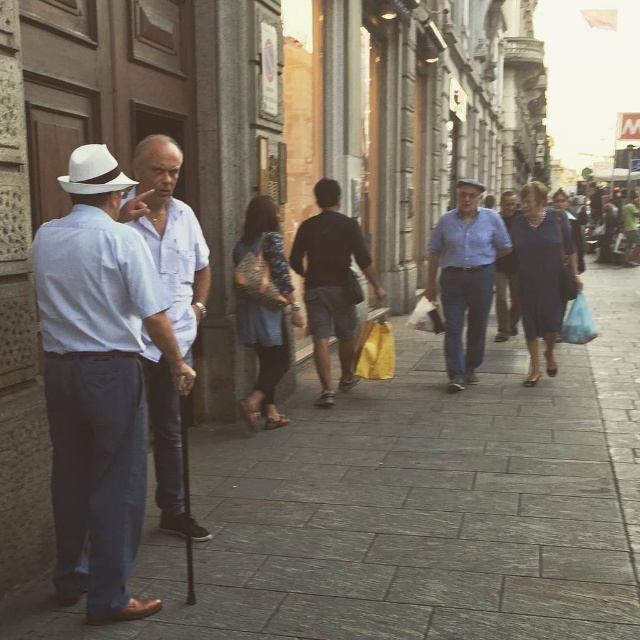
Question: Which object appears closest to the camera in this image?

Choices:
 (A) black felt fedora at center
 (B) gray stone pavement at left

Answer: (B)

Question: Can you confirm if matte white shirt at center is wider than white felt fedora at left?

Choices:
 (A) yes
 (B) no

Answer: (A)

Question: Is blue cotton shirt at center to the left of blue denim jeans at center from the viewer's perspective?

Choices:
 (A) yes
 (B) no

Answer: (A)

Question: Which point is farther to the camera?

Choices:
 (A) (x=516, y=308)
 (B) (x=300, y=272)

Answer: (A)

Question: Does white felt fedora at left have a greater width compared to blue denim jeans at center?

Choices:
 (A) no
 (B) yes

Answer: (A)

Question: Which point is closer to the camera?

Choices:
 (A) (177, 164)
 (B) (472, 182)
 (C) (109, 346)
 (D) (196, 556)

Answer: (C)